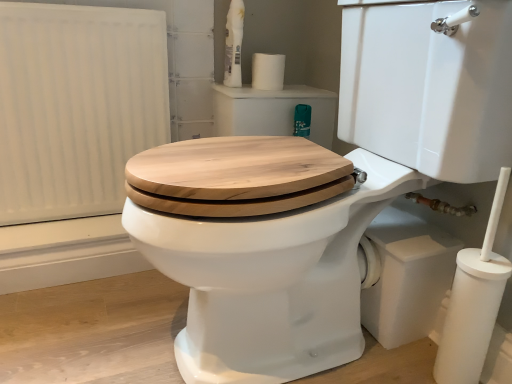
Identify the location of vacant area in front of white matte toilet paper at upper center. (263, 89).